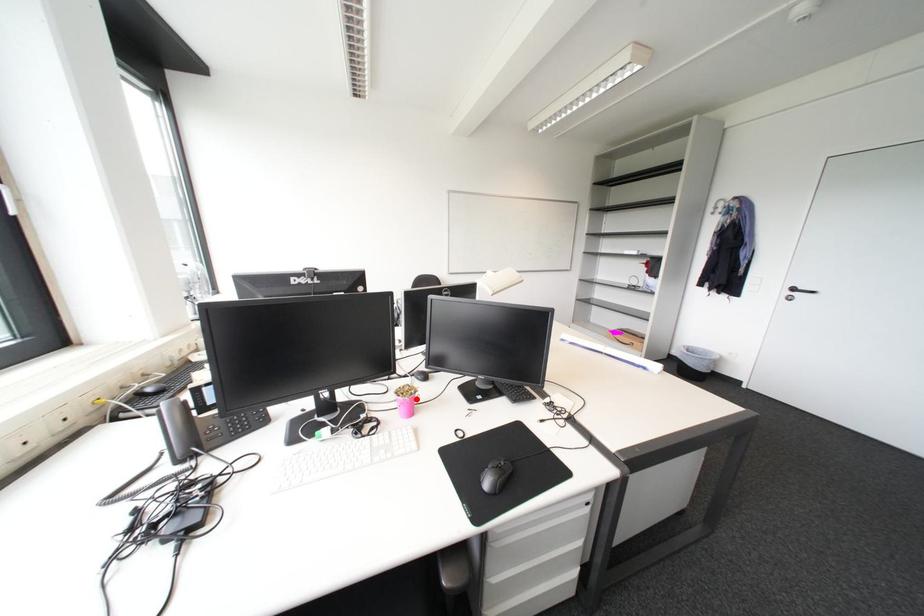
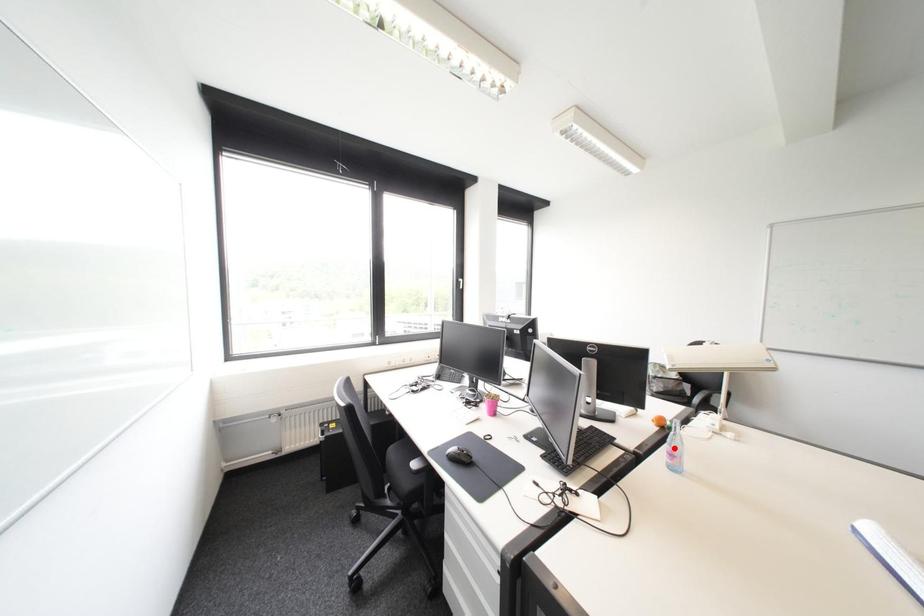
I am providing you with two images of the same scene from different viewpoints. A red point is marked on the first image and another point is marked on the second image. Is the marked point in image1 the same physical position as the marked point in image2?

No